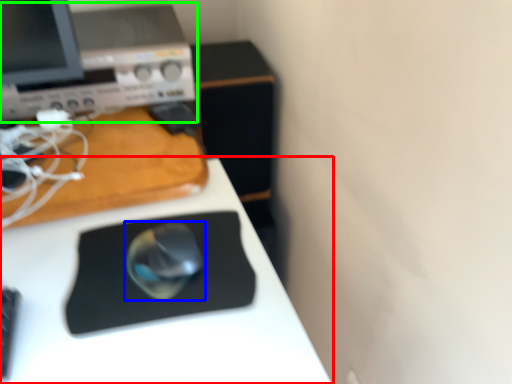
Question: Which is nearer to the desk (highlighted by a red box)? mouse (highlighted by a blue box) or desktop computer (highlighted by a green box).

Choices:
 (A) mouse
 (B) desktop computer

Answer: (A)